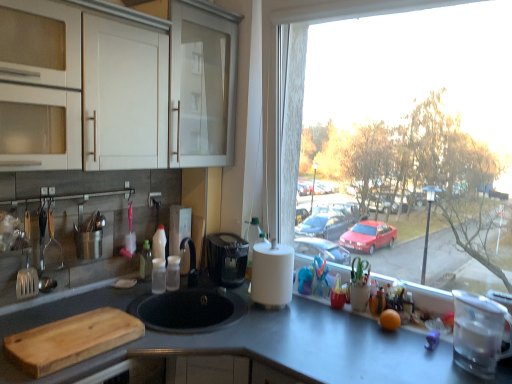
Question: Is satin nickel faucet at center, which appears as the first appliance when viewed from the back, positioned behind smooth gray countertop at center?

Choices:
 (A) no
 (B) yes

Answer: (B)

Question: Are satin nickel faucet at center, which appears as the first appliance when viewed from the back, and smooth gray countertop at center located far from each other?

Choices:
 (A) yes
 (B) no

Answer: (B)

Question: Is satin nickel faucet at center, placed as the second appliance when sorted from right to left, positioned in front of smooth gray countertop at center?

Choices:
 (A) no
 (B) yes

Answer: (A)

Question: From the image's perspective, would you say satin nickel faucet at center, placed as the second appliance when sorted from front to back, is shown under smooth gray countertop at center?

Choices:
 (A) no
 (B) yes

Answer: (A)

Question: Is smooth gray countertop at center surrounded by satin nickel faucet at center, placed as the second appliance when sorted from front to back?

Choices:
 (A) no
 (B) yes

Answer: (A)

Question: From a real-world perspective, is wooden cutting board at lower left physically located above or below white matte paper towel at center?

Choices:
 (A) below
 (B) above

Answer: (A)

Question: Do you think wooden cutting board at lower left is within white matte paper towel at center, or outside of it?

Choices:
 (A) outside
 (B) inside

Answer: (A)

Question: Considering their positions, is wooden cutting board at lower left located in front of or behind white matte paper towel at center?

Choices:
 (A) front
 (B) behind

Answer: (A)

Question: Is wooden cutting board at lower left taller or shorter than white matte paper towel at center?

Choices:
 (A) short
 (B) tall

Answer: (A)

Question: Considering the relative positions of satin nickel faucet at center, placed as the second appliance when sorted from front to back, and smooth gray countertop at center in the image provided, is satin nickel faucet at center, placed as the second appliance when sorted from front to back, to the left or to the right of smooth gray countertop at center?

Choices:
 (A) right
 (B) left

Answer: (B)

Question: Considering the positions of satin nickel faucet at center, positioned as the 1th appliance in left-to-right order, and smooth gray countertop at center in the image, is satin nickel faucet at center, positioned as the 1th appliance in left-to-right order, wider or thinner than smooth gray countertop at center?

Choices:
 (A) wide
 (B) thin

Answer: (B)

Question: In terms of size, does satin nickel faucet at center, placed as the second appliance when sorted from right to left, appear bigger or smaller than smooth gray countertop at center?

Choices:
 (A) small
 (B) big

Answer: (A)

Question: Is satin nickel faucet at center, placed as the second appliance when sorted from right to left, situated inside smooth gray countertop at center or outside?

Choices:
 (A) outside
 (B) inside

Answer: (A)

Question: Is wooden cutting board at lower left to the left or to the right of satin nickel faucet at center, positioned as the 1th appliance in left-to-right order, in the image?

Choices:
 (A) left
 (B) right

Answer: (A)

Question: Considering the positions of wooden cutting board at lower left and satin nickel faucet at center, which appears as the first appliance when viewed from the back, in the image, is wooden cutting board at lower left bigger or smaller than satin nickel faucet at center, which appears as the first appliance when viewed from the back,?

Choices:
 (A) small
 (B) big

Answer: (B)